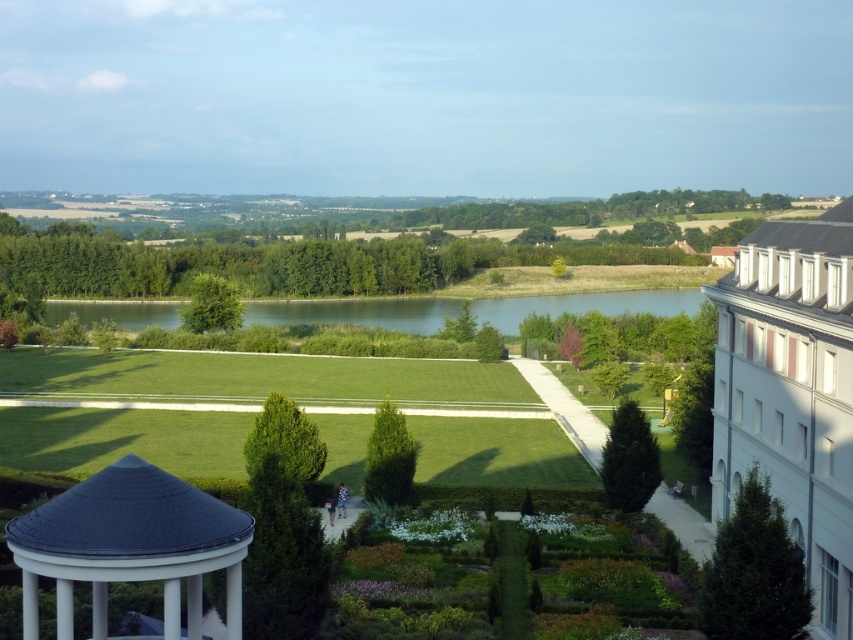
Describe the element at coordinates (131, 545) in the screenshot. This screenshot has width=853, height=640. I see `white textured gazebo at lower left` at that location.

Is point (132, 472) less distant than point (670, 292)?

That is True.

At what (x,y) coordinates should I click in order to perform the action: click on white textured gazebo at lower left. Please return your answer as a coordinate pair (x, y). The image size is (853, 640). Looking at the image, I should click on (131, 545).

This screenshot has width=853, height=640. Find the location of `white textured gazebo at lower left`. white textured gazebo at lower left is located at coordinates (131, 545).